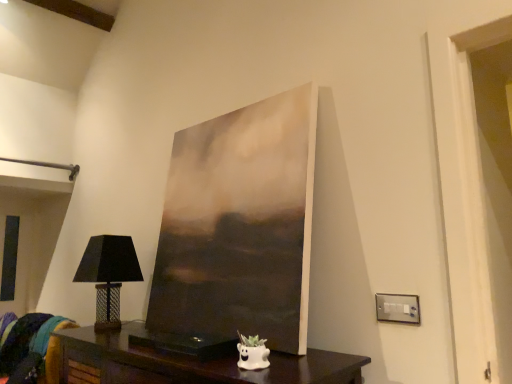
Question: Considering the relative sizes of dark wood table at lower center and velvet teal cushion at lower left in the image provided, is dark wood table at lower center bigger than velvet teal cushion at lower left?

Choices:
 (A) no
 (B) yes

Answer: (B)

Question: Is dark wood table at lower center facing towards velvet teal cushion at lower left?

Choices:
 (A) no
 (B) yes

Answer: (A)

Question: Can you confirm if dark wood table at lower center is thinner than velvet teal cushion at lower left?

Choices:
 (A) no
 (B) yes

Answer: (A)

Question: Is the depth of dark wood table at lower center greater than that of velvet teal cushion at lower left?

Choices:
 (A) no
 (B) yes

Answer: (A)

Question: Is dark wood table at lower center facing away from velvet teal cushion at lower left?

Choices:
 (A) yes
 (B) no

Answer: (B)

Question: Does dark wood table at lower center have a greater height compared to velvet teal cushion at lower left?

Choices:
 (A) no
 (B) yes

Answer: (B)

Question: Is satin silver switchplate at lower right further to the viewer compared to matte black lampshade at left?

Choices:
 (A) no
 (B) yes

Answer: (A)

Question: Is satin silver switchplate at lower right turned away from matte black lampshade at left?

Choices:
 (A) no
 (B) yes

Answer: (A)

Question: From the image's perspective, is satin silver switchplate at lower right beneath matte black lampshade at left?

Choices:
 (A) yes
 (B) no

Answer: (B)

Question: Is satin silver switchplate at lower right taller than matte black lampshade at left?

Choices:
 (A) no
 (B) yes

Answer: (A)

Question: Is satin silver switchplate at lower right directly adjacent to matte black lampshade at left?

Choices:
 (A) no
 (B) yes

Answer: (A)

Question: Can you confirm if satin silver switchplate at lower right is wider than matte black lampshade at left?

Choices:
 (A) yes
 (B) no

Answer: (B)

Question: Can you see dark wood table at lower center touching satin silver switchplate at lower right?

Choices:
 (A) yes
 (B) no

Answer: (B)